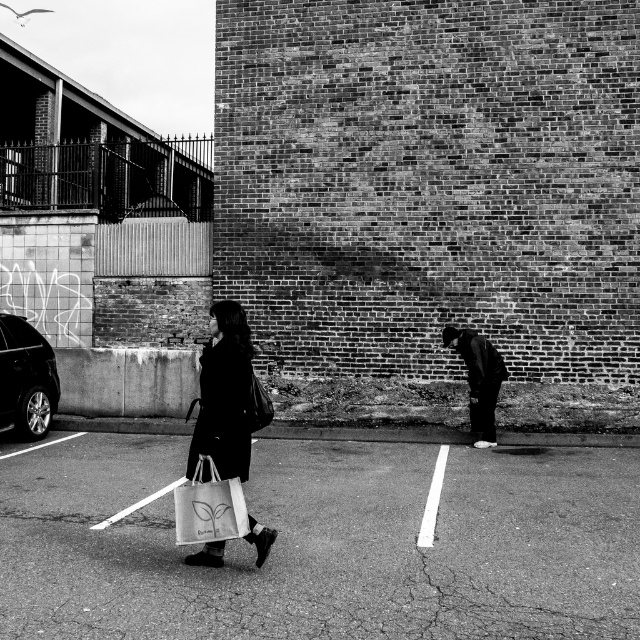
You are standing in the parking lot and want to take a photo of the shiny metallic car at left and the smooth asphalt parking lot at center. Which object should you focus on first if you want both to be in sharp focus?

The shiny metallic car at left is taller than the smooth asphalt parking lot at center, so you should focus on the shiny metallic car at left first to ensure both are in sharp focus.

You are a delivery person needing to place a package between the white canvas bag at center and the black matte jacket at right. The package requires 3 meters of space. Is there enough space?

The distance between the white canvas bag at center and the black matte jacket at right is 6.79 meters, which is more than enough to accommodate the 3 meter requirement for the package.

You are a delivery person who needs to park your shiny metallic car at left in the smooth asphalt parking lot at center. Is the parking lot in front of your car, making it easy to access?

The smooth asphalt parking lot at center is in front of the shiny metallic car at left, so yes, the parking lot is easily accessible from the car.